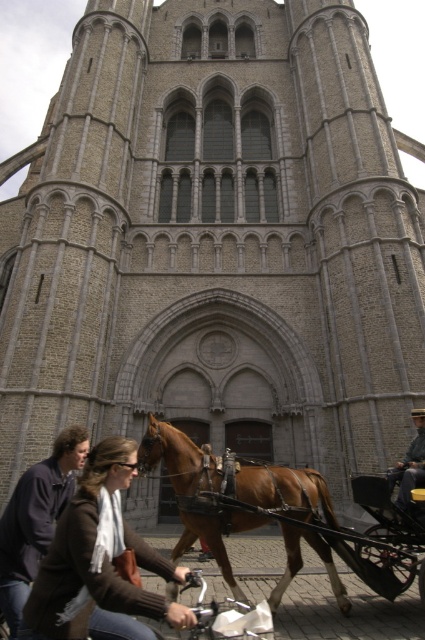
Question: Is brown glossy horse at center closer to camera compared to wooden cart at lower right?

Choices:
 (A) no
 (B) yes

Answer: (A)

Question: Which of these objects is positioned closest to the brown leather jacket at lower left?

Choices:
 (A) dark blue jacket at lower left
 (B) brown glossy horse at center
 (C) dark gray fabric coat at lower right
 (D) brown leather horse cart at lower center

Answer: (D)

Question: Is brown glossy horse at center in front of brown leather horse cart at lower center?

Choices:
 (A) yes
 (B) no

Answer: (B)

Question: Which point is closer to the camera?

Choices:
 (A) (14, 561)
 (B) (108, 579)

Answer: (B)

Question: Which is farther from the brown leather jacket at lower left?

Choices:
 (A) wooden cart at lower right
 (B) brown glossy horse at center
 (C) dark gray fabric coat at lower right

Answer: (C)

Question: Is brown leather jacket at lower left wider than brown leather horse cart at lower center?

Choices:
 (A) no
 (B) yes

Answer: (A)